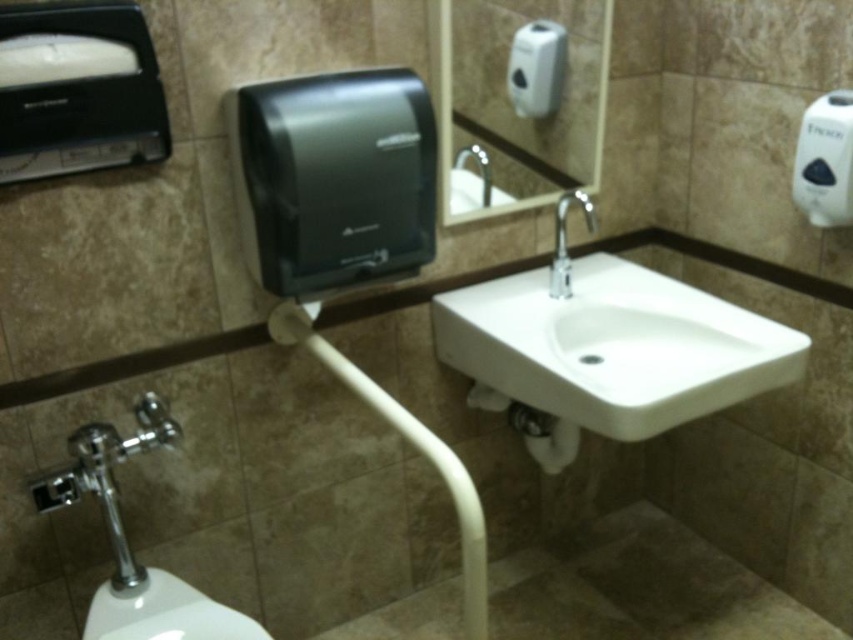
Question: Which object appears closest to the camera in this image?

Choices:
 (A) white plastic dispenser at upper right
 (B) white plastic hand dryer at upper center
 (C) white glossy toilet bowl at lower left

Answer: (C)

Question: Can you confirm if white glossy toilet bowl at lower left is bigger than white plastic hand dryer at upper center?

Choices:
 (A) no
 (B) yes

Answer: (B)

Question: Which point is farther to the camera?

Choices:
 (A) (486, 157)
 (B) (476, 301)
 (C) (24, 29)
 (D) (824, 221)

Answer: (B)

Question: Can you confirm if white glossy sink at center is positioned to the right of silver metallic faucet at center?

Choices:
 (A) no
 (B) yes

Answer: (B)

Question: From the image, what is the correct spatial relationship of black plastic hand dryer at upper left in relation to white plastic dispenser at upper right?

Choices:
 (A) left
 (B) right

Answer: (A)

Question: Which point is farther to the camera?

Choices:
 (A) silver metallic faucet at center
 (B) white glossy sink at center

Answer: (A)